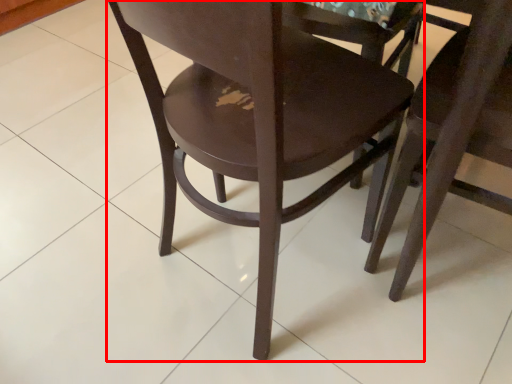
Question: From the image's perspective, what is the correct spatial relationship of chair (annotated by the red box) in relation to chair?

Choices:
 (A) below
 (B) above

Answer: (B)